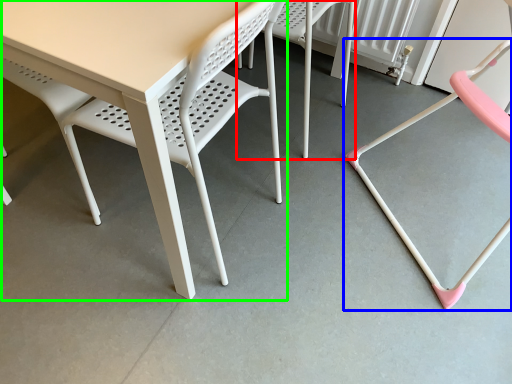
Question: Based on their relative distances, which object is nearer to chair (highlighted by a red box)? Choose from chair (highlighted by a blue box) and table (highlighted by a green box).

Choices:
 (A) chair
 (B) table

Answer: (A)